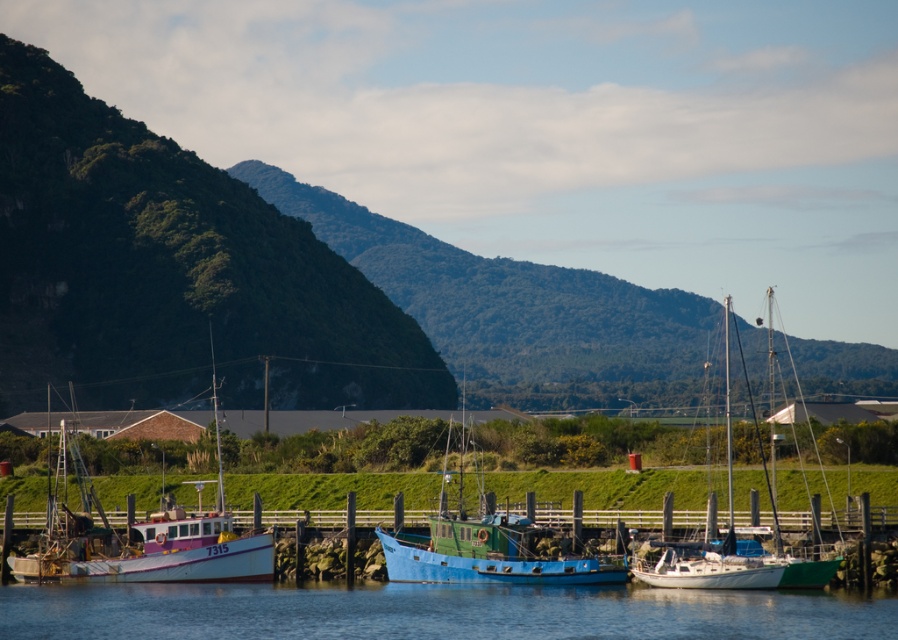
Looking at this image, you are a harbor inspector checking the docking arrangement. You need to determine the position of the blue matte boat at center relative to the white matte sailboat at center. Which boat is positioned to the left?

The blue matte boat at center is positioned on the left side of the white matte sailboat at center, so the blue matte boat at center is the one to the left.

You are standing at the edge of the marina and want to determine which of the two points, point (527, 621) or point (781, 576), is nearer to you. Based on the scene, which point is closer?

Point (527, 621) is closer to the viewer than point (781, 576).